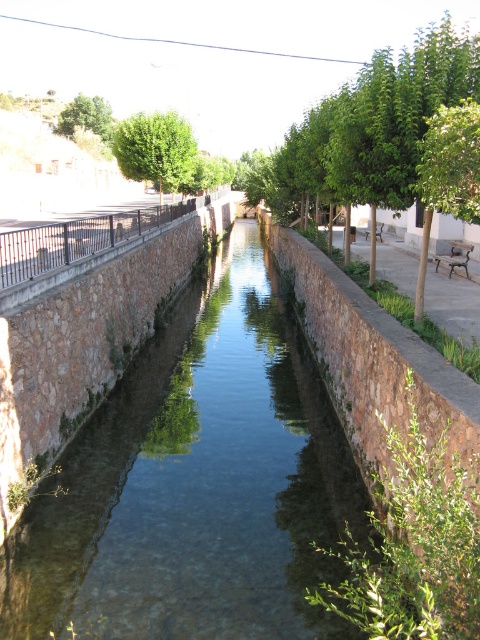
You are a delivery drone with a wingspan of 2 meters. You need to fly through the narrow canal depicted in the scene. The clear stone stream at center and the green leafy tree at center are in your path. Can you safely navigate between them without hitting either object?

The distance between the clear stone stream at center and the green leafy tree at center is 25.04 meters, which is more than enough for the drone to pass through safely as its wingspan is only 2 meters.

You are standing at the edge of the canal and want to know which tree is taller between the green leafy tree at upper center and the green leafy tree at upper left. Can you tell me which one is taller?

The green leafy tree at upper left is taller than the green leafy tree at upper center.

You are a hiker who wants to cross the clear stone stream at center. There is a green leafy tree at upper center nearby. Which object is smaller in size?

The clear stone stream at center is smaller in size compared to the green leafy tree at upper center.